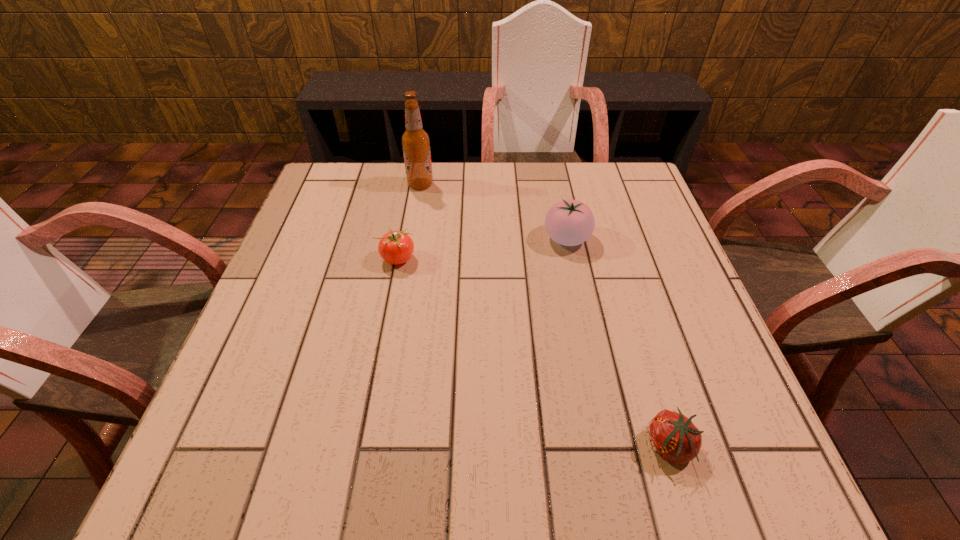
Where is `object situated at the far edge`? object situated at the far edge is located at coordinates (415, 141).

Locate an element on the screen. The width and height of the screenshot is (960, 540). object located at the near edge is located at coordinates (673, 436).

The image size is (960, 540). In order to click on object positioned at the right edge in this screenshot , I will do `click(673, 436)`.

Image resolution: width=960 pixels, height=540 pixels. In order to click on object situated at the near right corner in this screenshot , I will do `click(673, 436)`.

I want to click on vacant area at the far edge of the desktop, so click(x=468, y=171).

In the image, there is a desktop. Identify the location of free space at the left edge. The height and width of the screenshot is (540, 960). (293, 391).

At what (x,y) coordinates should I click in order to perform the action: click on blank area at the near left corner. Please return your answer as a coordinate pair (x, y). Looking at the image, I should click on pos(255,458).

Image resolution: width=960 pixels, height=540 pixels. What are the coordinates of `vacant region at the far right corner of the desktop` in the screenshot? It's located at (589, 180).

At what (x,y) coordinates should I click in order to perform the action: click on free location at the near right corner of the desktop. Please return your answer as a coordinate pair (x, y). The height and width of the screenshot is (540, 960). Looking at the image, I should click on (759, 457).

You are a GUI agent. You are given a task and a screenshot of the screen. Output one action in this format:
    pyautogui.click(x=<x>, y=<y>)
    Task: Click on the empty space between the tallest object and the shortest tomato
    This screenshot has width=960, height=540.
    Given the screenshot: What is the action you would take?
    pyautogui.click(x=545, y=315)